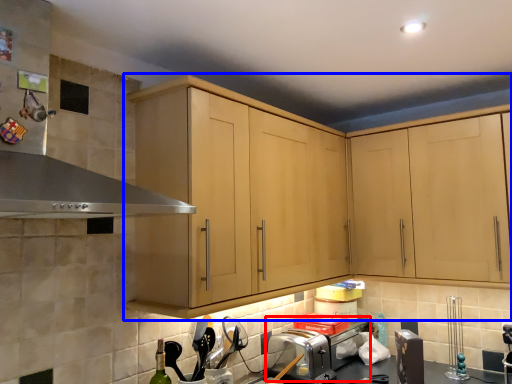
Question: Which point is closer to the camera, toaster (highlighted by a red box) or cabinetry (highlighted by a blue box)?

Choices:
 (A) toaster
 (B) cabinetry

Answer: (B)